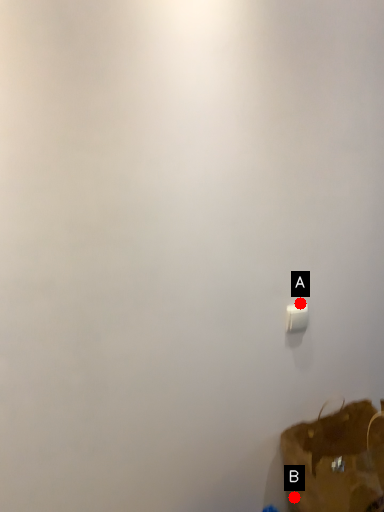
Question: Two points are circled on the image, labeled by A and B beside each circle. Which point appears farthest from the camera in this image?

Choices:
 (A) A is further
 (B) B is further

Answer: (B)